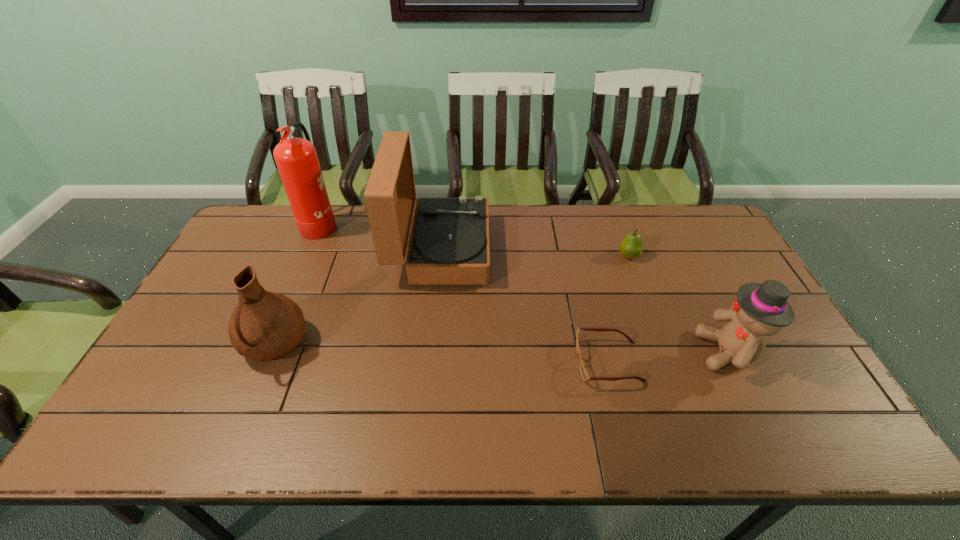
Identify the location of phonograph record at the far edge. (449, 244).

This screenshot has width=960, height=540. I want to click on object that is at the right edge, so click(760, 310).

In the image, there is a desktop. At what (x,y) coordinates should I click in order to perform the action: click on vacant space at the far edge. Please return your answer as a coordinate pair (x, y). Looking at the image, I should click on (560, 215).

Identify the location of vacant region at the near edge. [413, 449].

Find the location of a particular element. free space at the left edge is located at coordinates (267, 267).

I want to click on vacant point at the right edge, so click(794, 396).

This screenshot has width=960, height=540. What are the coordinates of `vacant space at the near left corner of the desktop` in the screenshot? It's located at click(159, 438).

This screenshot has width=960, height=540. What are the coordinates of `empty space between the pitcher and the phonograph record` in the screenshot? It's located at (357, 297).

This screenshot has height=540, width=960. I want to click on vacant space that is in between the rag_doll and the fire extinguisher, so click(524, 287).

Identify the location of blank region between the phonograph record and the pitcher. This screenshot has width=960, height=540. (357, 297).